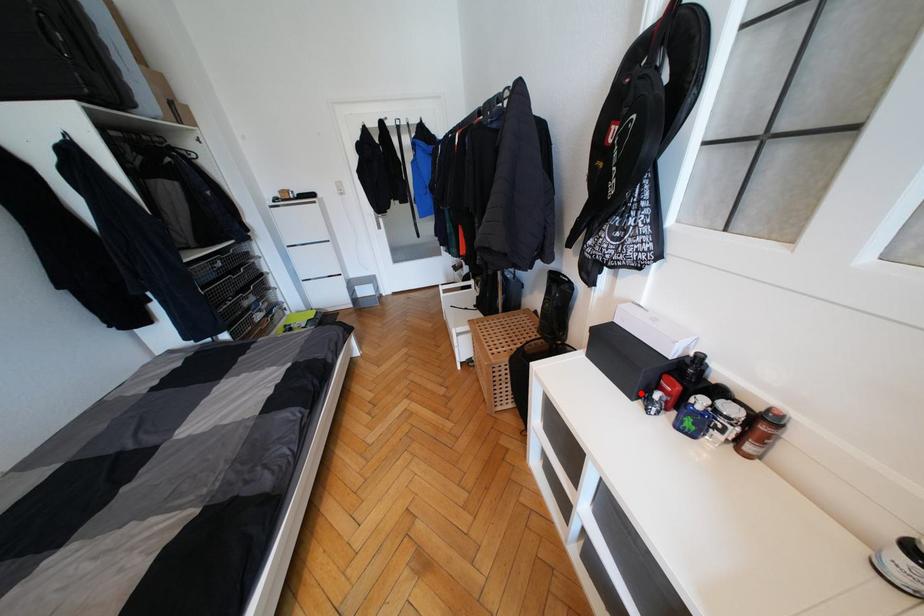
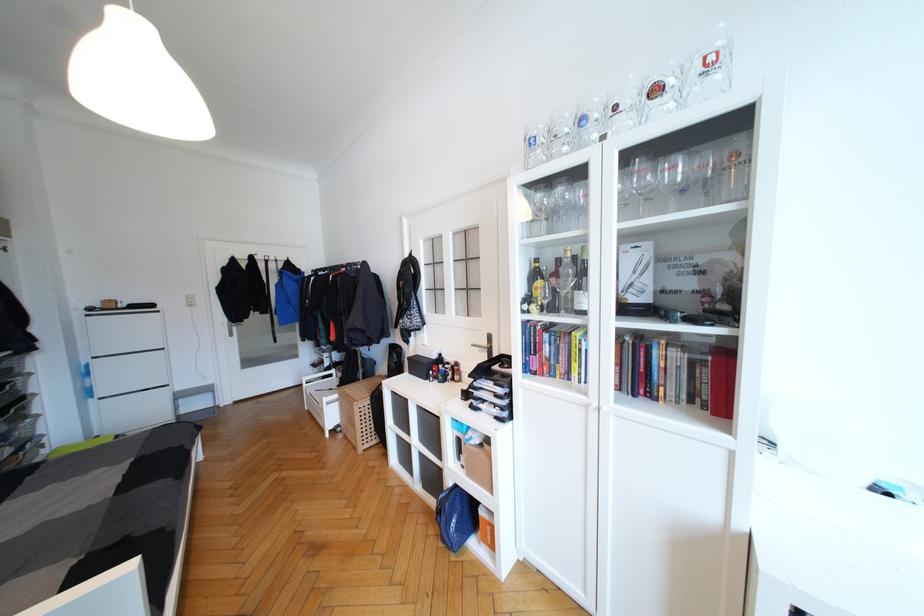
Locate, in the second image, the point that corresponds to the highlighted location in the first image.

(431, 378)